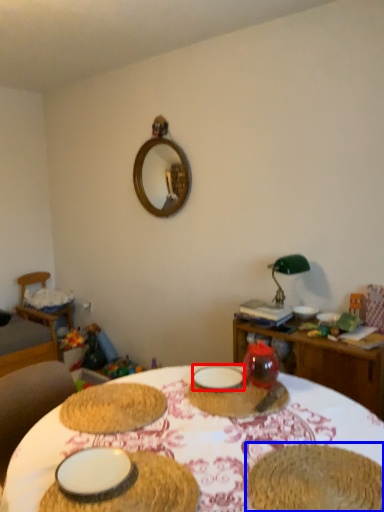
Question: Which point is closer to the camera, tableware (highlighted by a red box) or food (highlighted by a blue box)?

Choices:
 (A) tableware
 (B) food

Answer: (B)